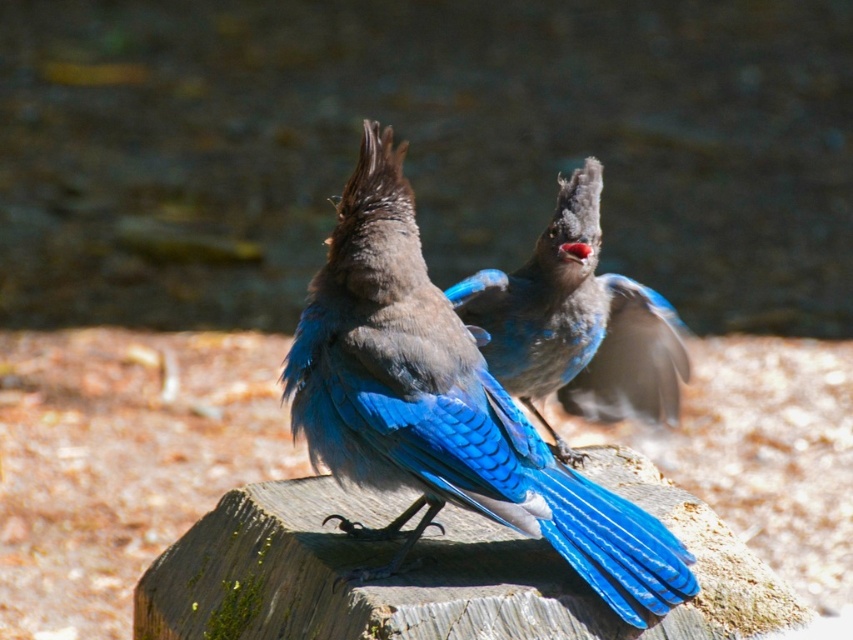
Question: Which object appears closest to the camera in this image?

Choices:
 (A) shiny blue feathers at center
 (B) blue glossy feathers at center

Answer: (A)

Question: Can you confirm if shiny blue feathers at center is positioned to the left of blue glossy feathers at center?

Choices:
 (A) no
 (B) yes

Answer: (B)

Question: Does shiny blue feathers at center have a lesser width compared to blue glossy feathers at center?

Choices:
 (A) yes
 (B) no

Answer: (B)

Question: Which point is closer to the camera?

Choices:
 (A) (509, 388)
 (B) (410, 440)

Answer: (B)

Question: Which point is closer to the camera?

Choices:
 (A) blue glossy feathers at center
 (B) shiny blue feathers at center

Answer: (B)

Question: Is shiny blue feathers at center behind blue glossy feathers at center?

Choices:
 (A) no
 (B) yes

Answer: (A)